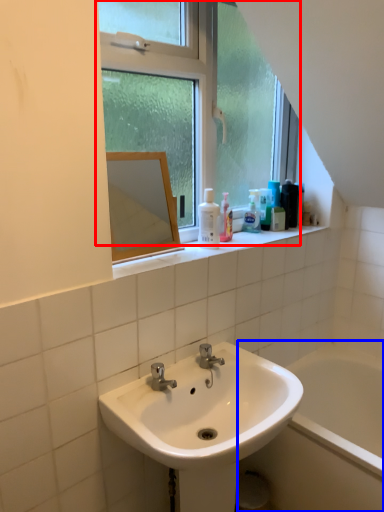
Question: Which object appears farthest to the camera in this image, window (highlighted by a red box) or bath (highlighted by a blue box)?

Choices:
 (A) window
 (B) bath

Answer: (B)